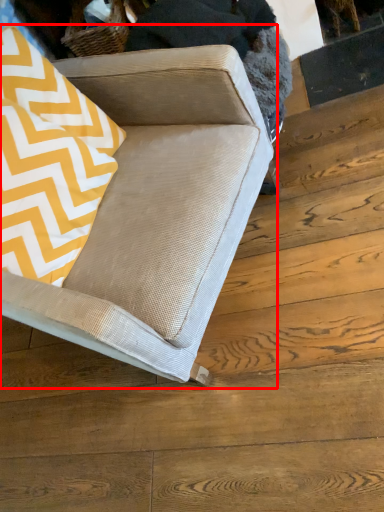
Question: From the image's perspective, where is studio couch (annotated by the red box) located relative to throw pillow?

Choices:
 (A) above
 (B) below

Answer: (B)